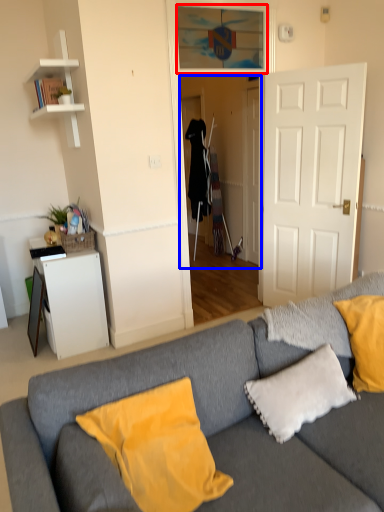
Question: Which point is further to the camera, window (highlighted by a red box) or glass door (highlighted by a blue box)?

Choices:
 (A) window
 (B) glass door

Answer: (B)